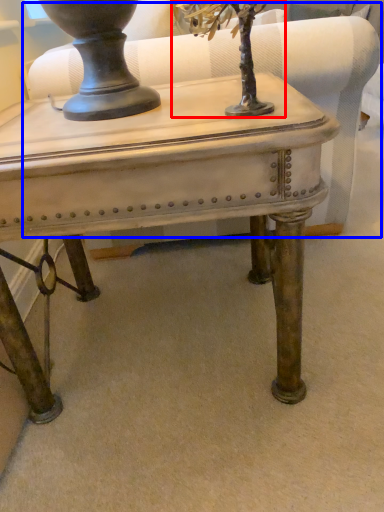
Question: Which point is closer to the camera, tree (highlighted by a red box) or swivel chair (highlighted by a blue box)?

Choices:
 (A) tree
 (B) swivel chair

Answer: (A)